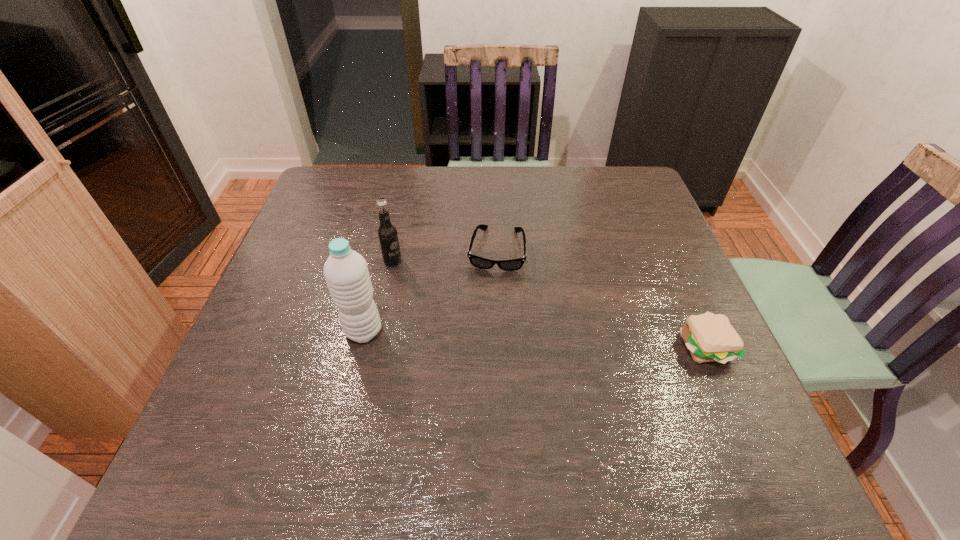
At what (x,y) coordinates should I click in order to perform the action: click on vacant position located 0.310m on the label of the second tallest object. Please return your answer as a coordinate pair (x, y). The height and width of the screenshot is (540, 960). Looking at the image, I should click on (497, 325).

Where is `vacant space located on the front-facing side of the shortest object`? vacant space located on the front-facing side of the shortest object is located at coordinates (481, 377).

You are a GUI agent. You are given a task and a screenshot of the screen. Output one action in this format:
    pyautogui.click(x=<x>, y=<y>)
    Task: Click on the free region located on the front-facing side of the shortest object
    Image resolution: width=960 pixels, height=540 pixels.
    Given the screenshot: What is the action you would take?
    pyautogui.click(x=482, y=373)

Locate an element on the screen. vacant space situated 0.400m on the front-facing side of the shortest object is located at coordinates (475, 424).

Where is `object present at the right edge`? object present at the right edge is located at coordinates (709, 337).

In order to click on vacant space at the far edge of the desktop in this screenshot , I will do `click(470, 190)`.

What are the coordinates of `vacant space at the near edge of the desktop` in the screenshot? It's located at (469, 404).

Where is `vacant space at the left edge of the desktop`? vacant space at the left edge of the desktop is located at coordinates (x=356, y=213).

The image size is (960, 540). Identify the location of vacant point at the far right corner. (606, 203).

Find the location of a particular element. The image size is (960, 540). vacant space that's between the water bottle and the patty is located at coordinates (535, 339).